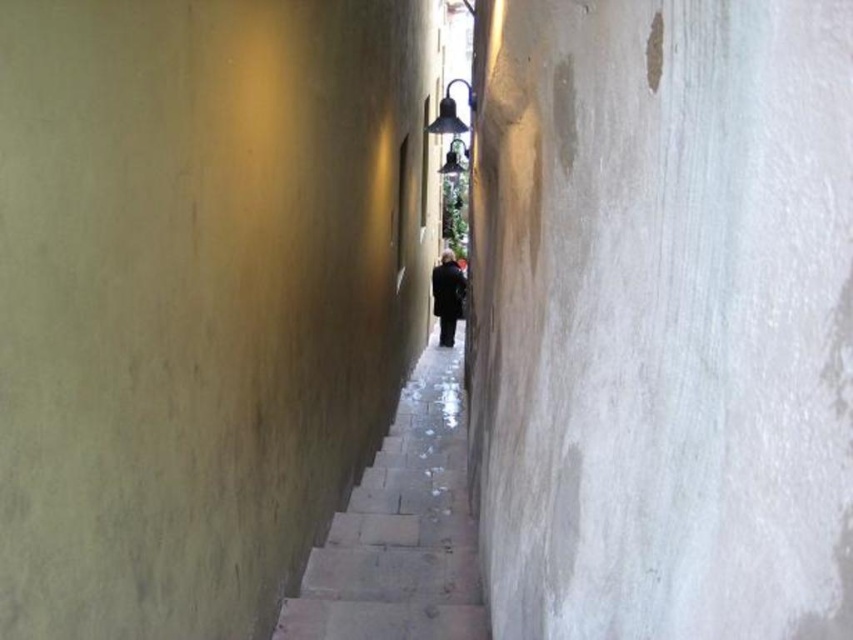
Question: Can you confirm if smooth stone steps at center is positioned to the left of dark wool coat at center?

Choices:
 (A) yes
 (B) no

Answer: (A)

Question: Which of the following is the farthest from the observer?

Choices:
 (A) (378, 596)
 (B) (451, 301)

Answer: (B)

Question: From the image, what is the correct spatial relationship of smooth stone steps at center in relation to dark wool coat at center?

Choices:
 (A) above
 (B) below

Answer: (B)

Question: Can you confirm if smooth stone steps at center is wider than dark wool coat at center?

Choices:
 (A) yes
 (B) no

Answer: (A)